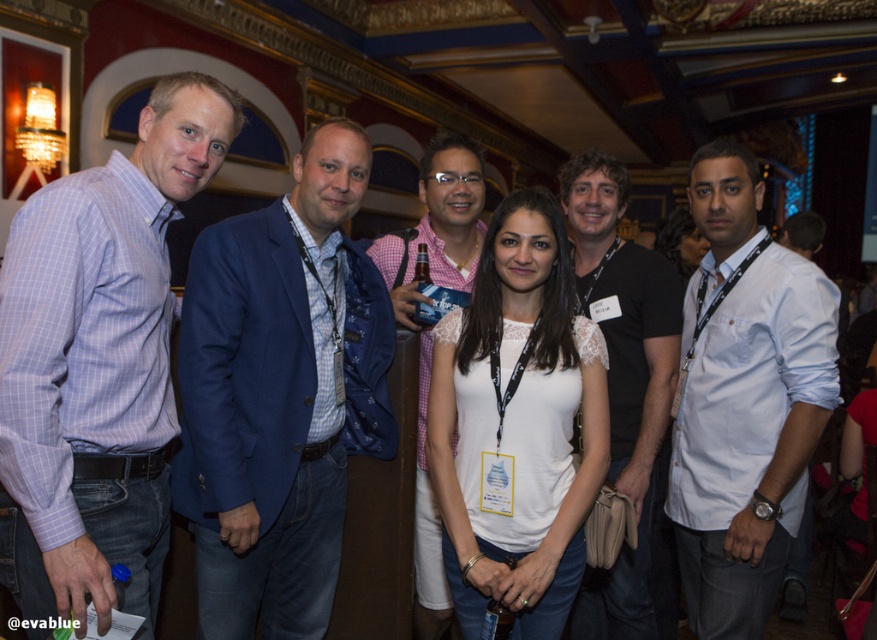
You are standing at the center of the room and want to move towards the point marked at coordinates (98, 362). Which direction should you head to reach that point?

The point at coordinates (98, 362) is located on the matte purple shirt at left, so you should move towards the left side of the room to reach it.

You are standing at the entrance of the venue and notice two points marked in the image. The first point is at coordinates point (653, 477) and the second is at point (469, 244). Which point is closer to you?

Point (653, 477) is in front of point (469, 244), so it is closer to you.

You are organizing a photo shoot and need to ensure that the white lace top at center and the pink checkered shirt at center are at least 20 inches apart for better visibility. Based on the image, is the current distance sufficient?

The white lace top at center and the pink checkered shirt at center are 19.48 inches apart from each other, which is less than the required 20 inches. The current distance is insufficient for the desired visibility.